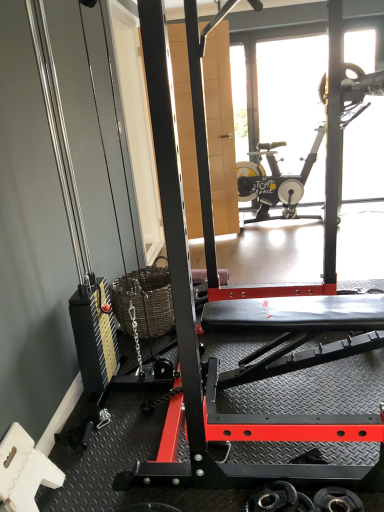
The image size is (384, 512). Find the location of `metallic black weight at lower center, the 2th wheel in the right-to-left sequence`. metallic black weight at lower center, the 2th wheel in the right-to-left sequence is located at coordinates (278, 499).

I want to click on transparent glass door at upper center, so click(280, 92).

Is black rubber weight at lower right, the 2th wheel viewed from the left, turned away from transparent glass door at upper center?

No.

Does point (333, 500) come closer to viewer compared to point (236, 133)?

Yes, it is.

Is transparent glass door at upper center surrounded by metallic black weight at lower center, the 2th wheel in the right-to-left sequence?

That's incorrect, transparent glass door at upper center is not inside metallic black weight at lower center, the 2th wheel in the right-to-left sequence.

Does metallic black weight at lower center, the 2th wheel in the right-to-left sequence, have a larger size compared to transparent glass door at upper center?

No.

From a real-world perspective, is metallic black weight at lower center, the 2th wheel in the right-to-left sequence, positioned under transparent glass door at upper center based on gravity?

Yes, from a real-world perspective, metallic black weight at lower center, the 2th wheel in the right-to-left sequence, is below transparent glass door at upper center.

From the image's perspective, is metallic black weight at lower center, acting as the 1th wheel starting from the left, on transparent glass door at upper center?

No, from the image's perspective, metallic black weight at lower center, acting as the 1th wheel starting from the left, is not above transparent glass door at upper center.

Considering the sizes of objects metallic black weight at lower center, acting as the 1th wheel starting from the left, and black rubber weight at lower right, arranged as the first wheel when viewed from the right, in the image provided, who is taller, metallic black weight at lower center, acting as the 1th wheel starting from the left, or black rubber weight at lower right, arranged as the first wheel when viewed from the right,?

With more height is metallic black weight at lower center, acting as the 1th wheel starting from the left.

How different are the orientations of metallic black weight at lower center, the 2th wheel in the right-to-left sequence, and black rubber weight at lower right, the 2th wheel viewed from the left, in degrees?

The angular difference between metallic black weight at lower center, the 2th wheel in the right-to-left sequence, and black rubber weight at lower right, the 2th wheel viewed from the left, is 89.5 degrees.

Are metallic black weight at lower center, acting as the 1th wheel starting from the left, and black rubber weight at lower right, arranged as the first wheel when viewed from the right, far apart?

No.

Which is behind, point (256, 493) or point (329, 508)?

Point (256, 493)

The width and height of the screenshot is (384, 512). In the image, there is a black rubber weight at lower right, the 2th wheel viewed from the left. Find the location of `wheel below it (from a real-world perspective)`. wheel below it (from a real-world perspective) is located at coordinates (278, 499).

Considering the sizes of objects black rubber weight at lower right, arranged as the first wheel when viewed from the right, and metallic black weight at lower center, the 2th wheel in the right-to-left sequence, in the image provided, who is taller, black rubber weight at lower right, arranged as the first wheel when viewed from the right, or metallic black weight at lower center, the 2th wheel in the right-to-left sequence,?

With more height is metallic black weight at lower center, the 2th wheel in the right-to-left sequence.

Can you confirm if black rubber weight at lower right, the 2th wheel viewed from the left, is bigger than metallic black weight at lower center, the 2th wheel in the right-to-left sequence?

Incorrect, black rubber weight at lower right, the 2th wheel viewed from the left, is not larger than metallic black weight at lower center, the 2th wheel in the right-to-left sequence.

Considering the sizes of transparent glass door at upper center and metallic black weight at lower center, the 2th wheel in the right-to-left sequence, in the image, is transparent glass door at upper center taller or shorter than metallic black weight at lower center, the 2th wheel in the right-to-left sequence,?

In the image, transparent glass door at upper center appears to be taller than metallic black weight at lower center, the 2th wheel in the right-to-left sequence.

From a real-world perspective, is transparent glass door at upper center on metallic black weight at lower center, acting as the 1th wheel starting from the left?

Yes.

Who is smaller, transparent glass door at upper center or metallic black weight at lower center, acting as the 1th wheel starting from the left?

metallic black weight at lower center, acting as the 1th wheel starting from the left, is smaller.

Which point is more distant from viewer, (284, 151) or (340, 494)?

The point (284, 151) is farther from the camera.

Looking at this image, considering the relative positions of transparent glass door at upper center and black rubber weight at lower right, the 2th wheel viewed from the left, in the image provided, is transparent glass door at upper center to the left or to the right of black rubber weight at lower right, the 2th wheel viewed from the left,?

Clearly, transparent glass door at upper center is on the right of black rubber weight at lower right, the 2th wheel viewed from the left, in the image.

Which is behind, transparent glass door at upper center or black rubber weight at lower right, arranged as the first wheel when viewed from the right?

transparent glass door at upper center is behind.

Locate an element on the screen. the 1st wheel in front of the transparent glass door at upper center is located at coordinates (337, 500).

Locate an element on the screen. wheel that is the 2nd object to the left of the transparent glass door at upper center, starting at the anchor is located at coordinates 278,499.

Based on their spatial positions, is metallic black weight at lower center, acting as the 1th wheel starting from the left, or black rubber weight at lower right, the 2th wheel viewed from the left, closer to transparent glass door at upper center?

metallic black weight at lower center, acting as the 1th wheel starting from the left, is positioned closer to the anchor transparent glass door at upper center.

When comparing their distances from metallic black weight at lower center, the 2th wheel in the right-to-left sequence, does transparent glass door at upper center or black rubber weight at lower right, the 2th wheel viewed from the left, seem further?

Among the two, transparent glass door at upper center is located further to metallic black weight at lower center, the 2th wheel in the right-to-left sequence.

Looking at the image, which one is located further to metallic black weight at lower center, acting as the 1th wheel starting from the left, black rubber weight at lower right, the 2th wheel viewed from the left, or transparent glass door at upper center?

transparent glass door at upper center is further to metallic black weight at lower center, acting as the 1th wheel starting from the left.

Which object lies nearer to the anchor point transparent glass door at upper center, black rubber weight at lower right, the 2th wheel viewed from the left, or metallic black weight at lower center, acting as the 1th wheel starting from the left?

metallic black weight at lower center, acting as the 1th wheel starting from the left, is closer to transparent glass door at upper center.

Based on their spatial positions, is metallic black weight at lower center, acting as the 1th wheel starting from the left, or transparent glass door at upper center closer to black rubber weight at lower right, the 2th wheel viewed from the left?

Based on the image, metallic black weight at lower center, acting as the 1th wheel starting from the left, appears to be nearer to black rubber weight at lower right, the 2th wheel viewed from the left.

Considering their positions, is transparent glass door at upper center positioned closer to black rubber weight at lower right, the 2th wheel viewed from the left, than metallic black weight at lower center, the 2th wheel in the right-to-left sequence?

Among the two, metallic black weight at lower center, the 2th wheel in the right-to-left sequence, is located nearer to black rubber weight at lower right, the 2th wheel viewed from the left.

Identify the location of wheel positioned between metallic black weight at lower center, acting as the 1th wheel starting from the left, and transparent glass door at upper center from near to far. This screenshot has height=512, width=384. (337, 500).